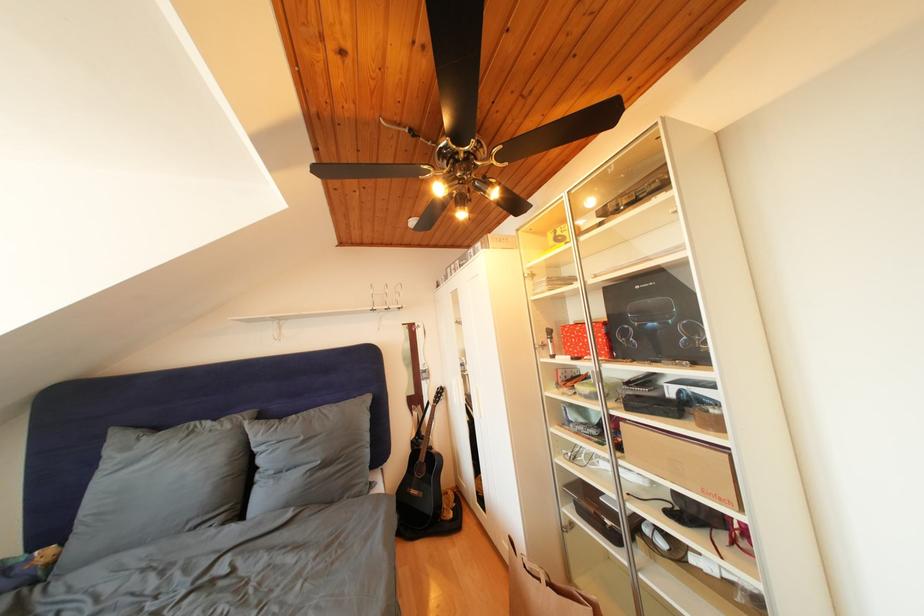
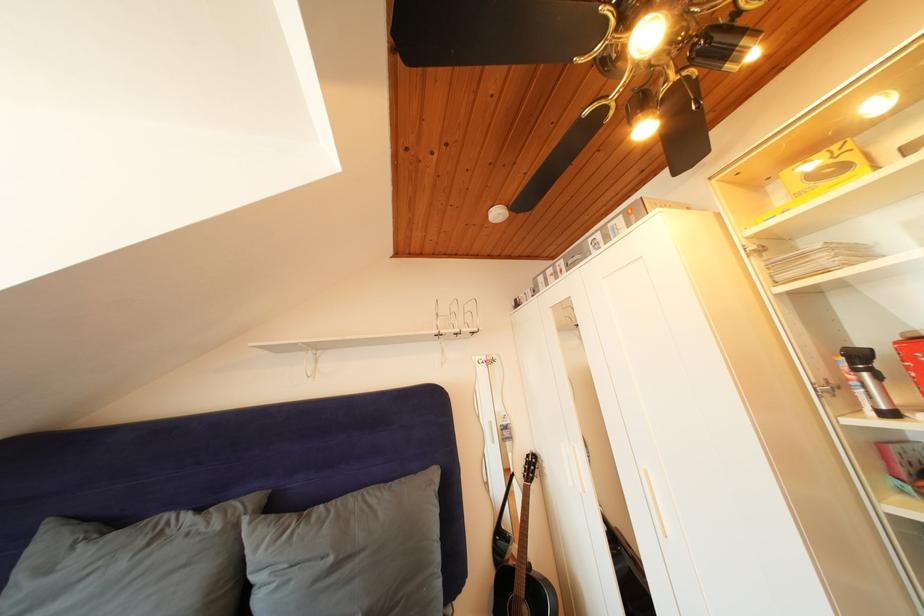
Find the pixel in the second image that matches point 552,351 in the first image.

(844, 392)